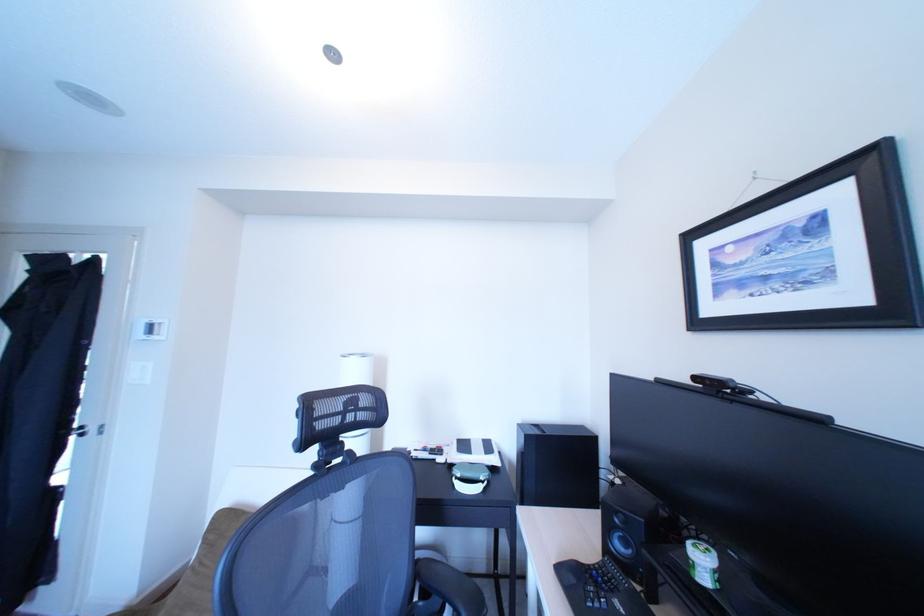
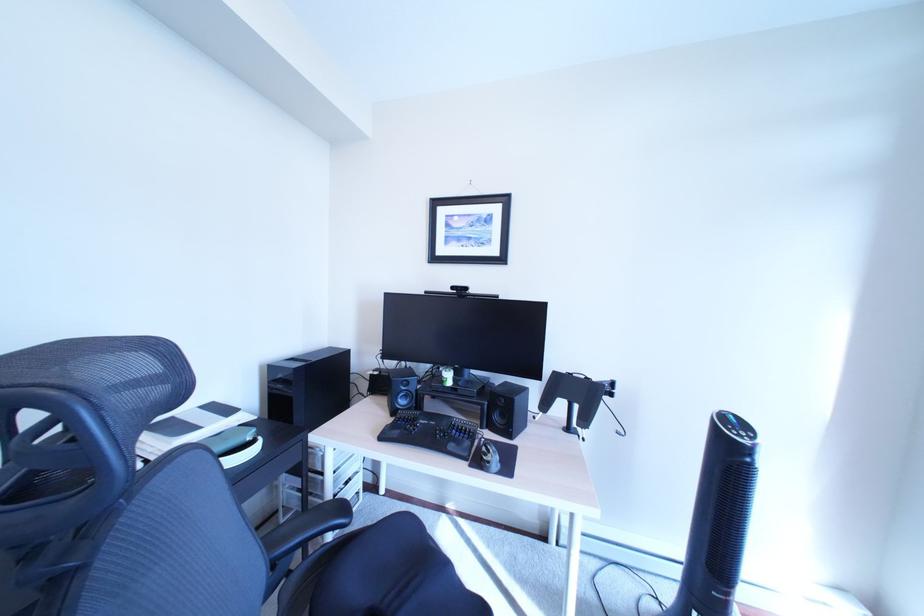
Question: The camera is either moving clockwise (left) or counter-clockwise (right) around the object. The first image is from the beginning of the video and the second image is from the end. Is the camera moving left or right when shooting the video?

Choices:
 (A) Left
 (B) Right

Answer: (A)